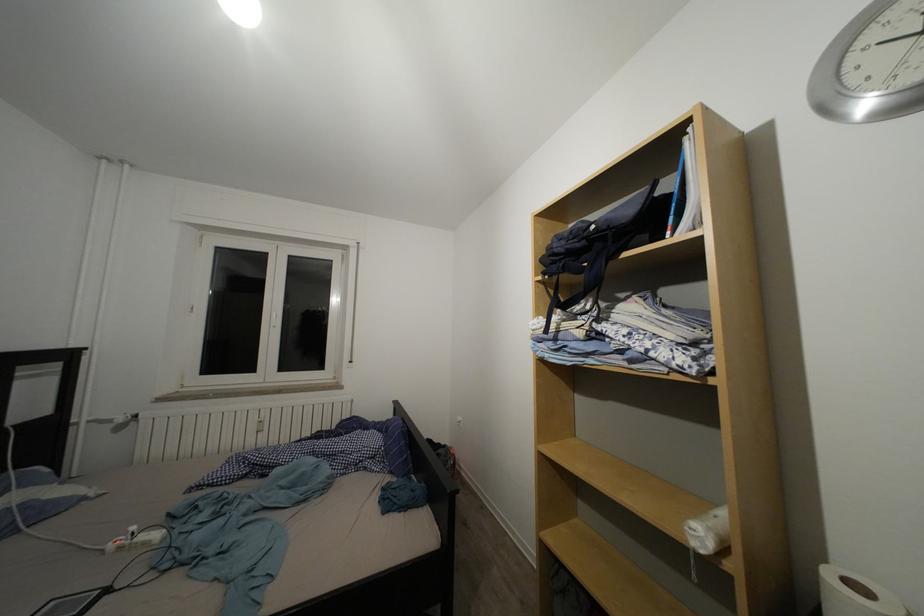
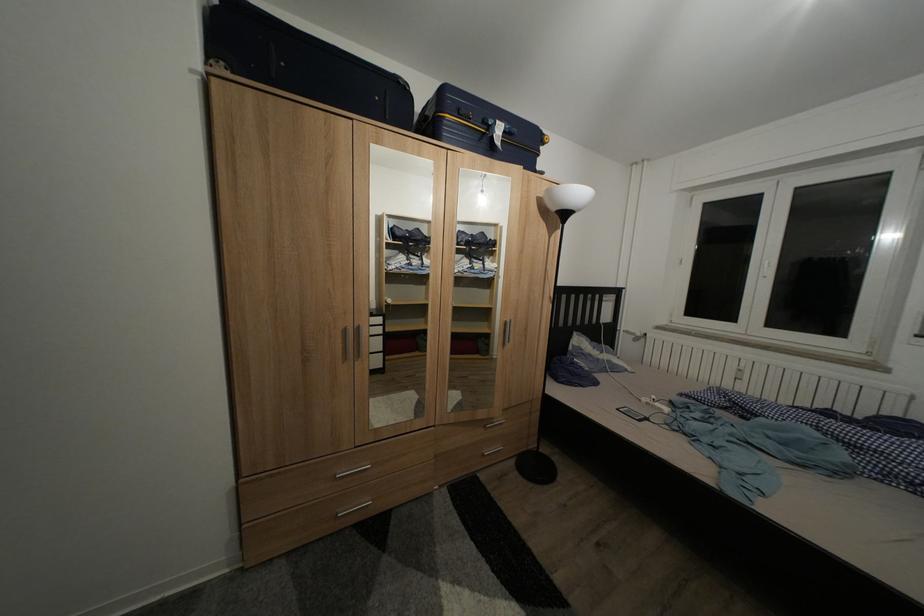
Question: The images are taken continuously from a first-person perspective. In which direction is your viewpoint rotating?

Choices:
 (A) Left
 (B) Right
 (C) Up
 (D) Down

Answer: (A)